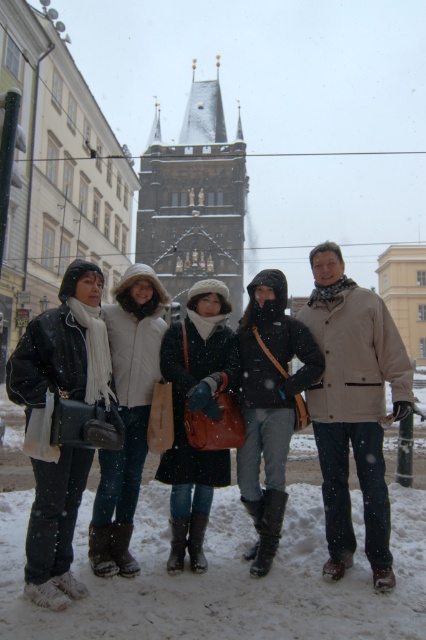
Question: Does brown stone tower at center appear on the right side of white woolen hat at center?

Choices:
 (A) no
 (B) yes

Answer: (B)

Question: Considering the real-world distances, which object is farthest from the matte black coat at center?

Choices:
 (A) white woolen hat at center
 (B) brown stone tower at center
 (C) matte black jacket at left

Answer: (B)

Question: Can you confirm if brown stone tower at center is positioned to the right of matte black coat at center?

Choices:
 (A) yes
 (B) no

Answer: (B)

Question: Can you confirm if matte black jacket at left is positioned above matte black coat at center?

Choices:
 (A) yes
 (B) no

Answer: (A)

Question: Which of these objects is positioned closest to the matte black jacket at left?

Choices:
 (A) matte black coat at center
 (B) brown stone tower at center

Answer: (A)

Question: Which object is closer to the camera taking this photo?

Choices:
 (A) matte black coat at center
 (B) brown stone tower at center
 (C) white woolen hat at center

Answer: (C)